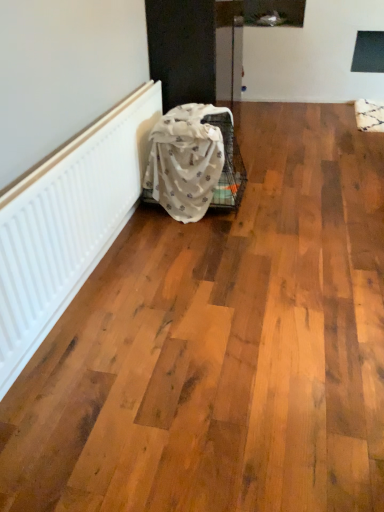
Identify the location of vacant area located to the right-hand side of white textured fabric at lower left. (279, 197).